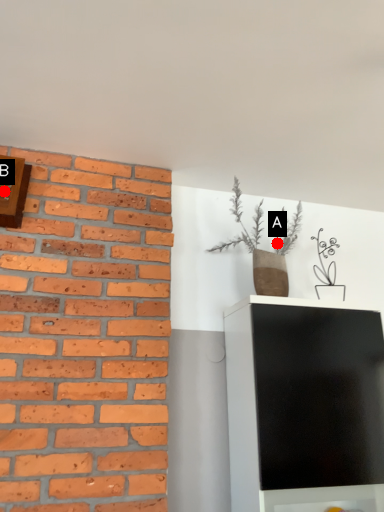
Question: Two points are circled on the image, labeled by A and B beside each circle. Which of the following is the farthest from the observer?

Choices:
 (A) A is further
 (B) B is further

Answer: (A)